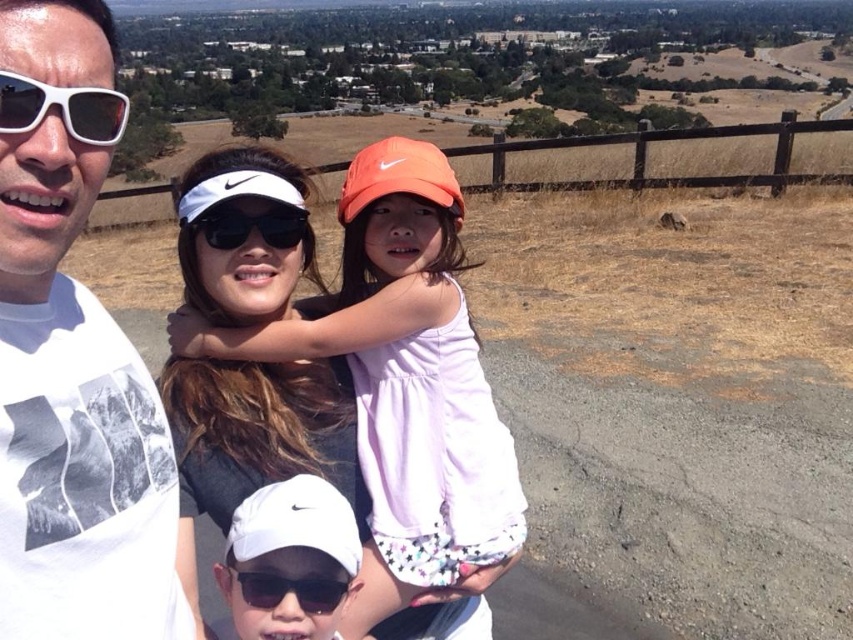
Which is below, white printed t-shirt at left or white cotton dress at center?

Positioned lower is white cotton dress at center.

Who is taller, white printed t-shirt at left or white cotton dress at center?

white cotton dress at center

Is point (21, 237) farther from camera compared to point (335, 454)?

No.

You are a GUI agent. You are given a task and a screenshot of the screen. Output one action in this format:
    pyautogui.click(x=<x>, y=<y>)
    Task: Click on the white printed t-shirt at left
    
    Given the screenshot: What is the action you would take?
    pyautogui.click(x=74, y=420)

Is white cotton dress at center closer to camera compared to black plastic sunglasses at lower center?

No, white cotton dress at center is behind black plastic sunglasses at lower center.

How far apart are white cotton dress at center and black plastic sunglasses at lower center?

white cotton dress at center is 24.14 inches from black plastic sunglasses at lower center.

This screenshot has height=640, width=853. I want to click on white cotton dress at center, so click(256, 440).

Does white cotton dress at center have a greater width compared to white matte sunglasses at upper left?

Correct, the width of white cotton dress at center exceeds that of white matte sunglasses at upper left.

Does point (285, 170) lie behind point (103, 136)?

Yes, point (285, 170) is farther from viewer.

Locate an element on the screen. The width and height of the screenshot is (853, 640). white cotton dress at center is located at coordinates (256, 440).